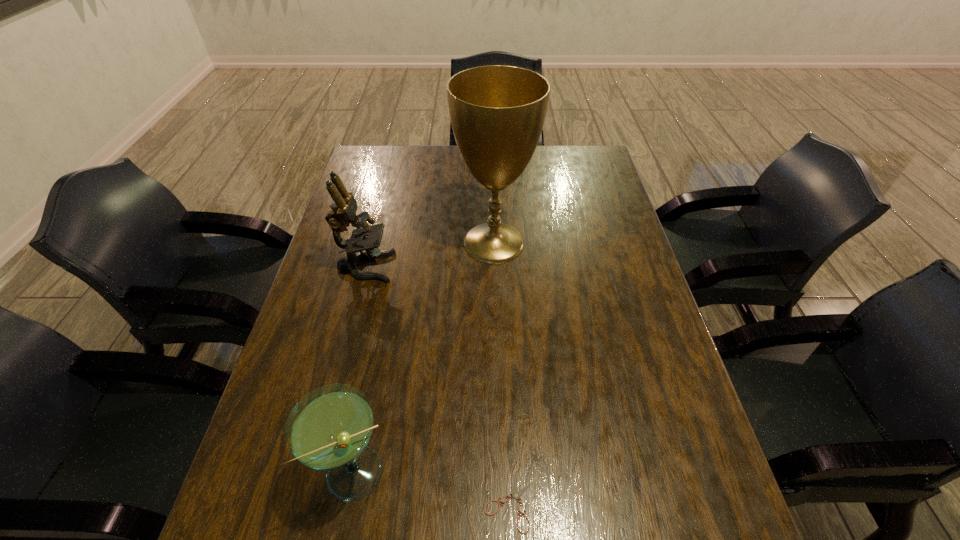
This screenshot has width=960, height=540. I want to click on trophy cup, so click(497, 112).

This screenshot has width=960, height=540. I want to click on the second tallest object, so 343,213.

This screenshot has height=540, width=960. In order to click on the third tallest object in this screenshot , I will do `click(329, 429)`.

This screenshot has width=960, height=540. I want to click on the shortest object, so pos(516,494).

Locate an element on the screen. vacant space located 0.200m on the right of the trophy cup is located at coordinates tap(599, 242).

This screenshot has height=540, width=960. Find the location of `vacant area located 0.360m at the eyepieces of the second tallest object`. vacant area located 0.360m at the eyepieces of the second tallest object is located at coordinates (518, 267).

What are the coordinates of `vacant area situated 0.060m on the left of the martini` in the screenshot? It's located at (288, 472).

This screenshot has height=540, width=960. Find the location of `vacant space situated on the right of the shortest object`. vacant space situated on the right of the shortest object is located at coordinates (719, 503).

Where is `microscope that is at the left edge`? Image resolution: width=960 pixels, height=540 pixels. microscope that is at the left edge is located at coordinates (343, 213).

In order to click on martini that is at the left edge in this screenshot , I will do point(329,429).